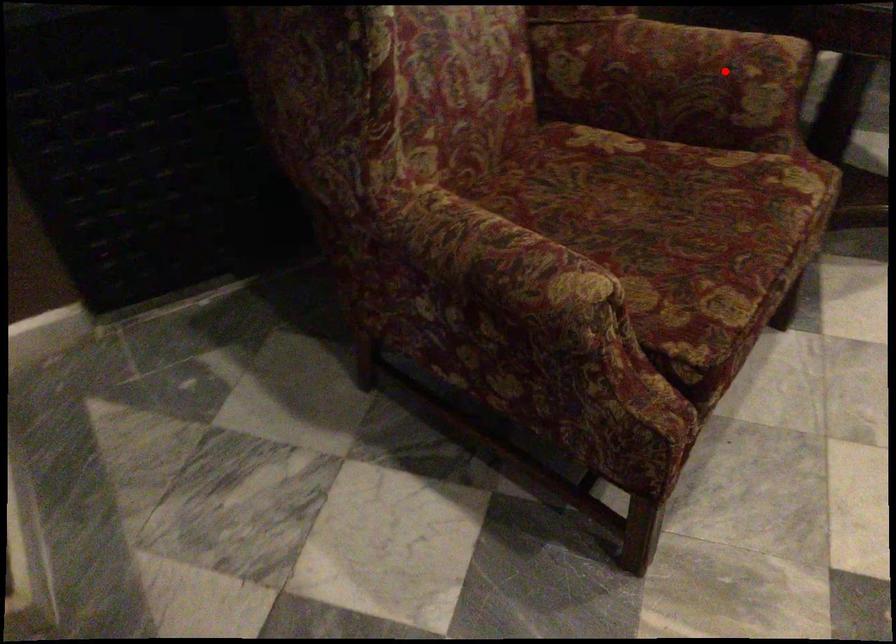
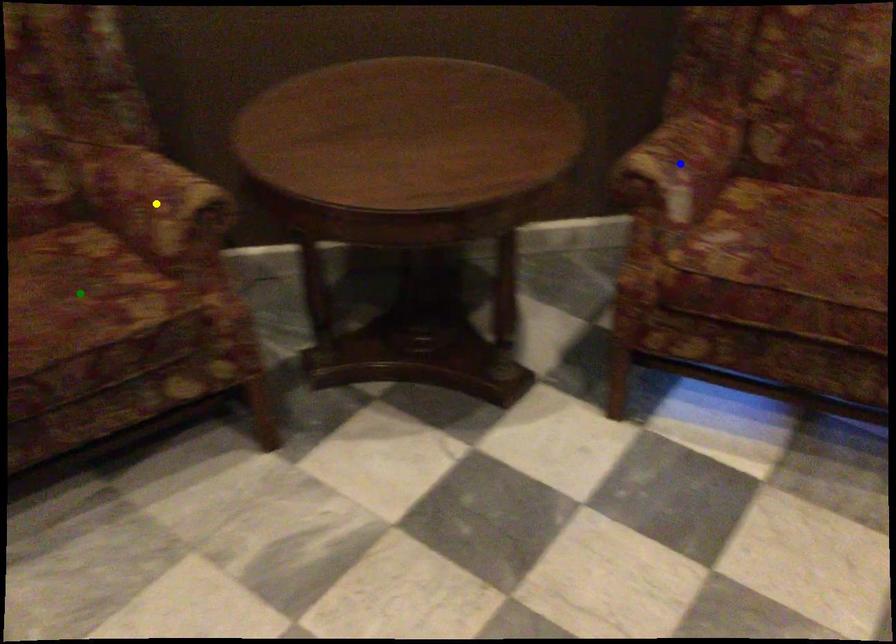
Question: I am providing you with two images of the same scene from different viewpoints. A red point is marked on the first image. You are given multiple points on the second image. Which mark in image 2 goes with the point in image 1?

Choices:
 (A) green point
 (B) yellow point
 (C) blue point

Answer: (B)